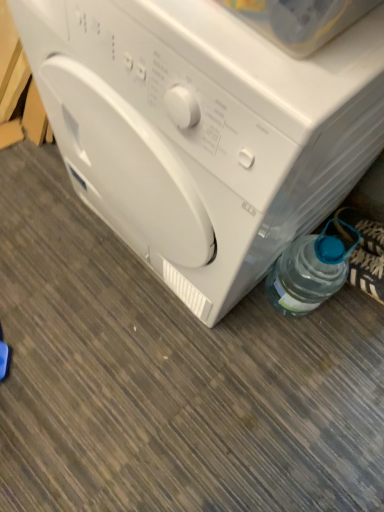
Question: Is clear plastic bottle at lower right at the back of white plastic washing machine at center?

Choices:
 (A) no
 (B) yes

Answer: (A)

Question: Can you confirm if white plastic washing machine at center is positioned to the left of clear plastic bottle at lower right?

Choices:
 (A) yes
 (B) no

Answer: (A)

Question: Considering the relative sizes of white plastic washing machine at center and clear plastic bottle at lower right in the image provided, is white plastic washing machine at center wider than clear plastic bottle at lower right?

Choices:
 (A) yes
 (B) no

Answer: (A)

Question: Is white plastic washing machine at center taller than clear plastic bottle at lower right?

Choices:
 (A) yes
 (B) no

Answer: (B)

Question: Is white plastic washing machine at center bigger than clear plastic bottle at lower right?

Choices:
 (A) yes
 (B) no

Answer: (A)

Question: Is clear plastic bottle at lower right taller or shorter than white plastic washing machine at center?

Choices:
 (A) tall
 (B) short

Answer: (A)

Question: Considering the positions of clear plastic bottle at lower right and white plastic washing machine at center in the image, is clear plastic bottle at lower right wider or thinner than white plastic washing machine at center?

Choices:
 (A) wide
 (B) thin

Answer: (B)

Question: From the image's perspective, is clear plastic bottle at lower right above or below white plastic washing machine at center?

Choices:
 (A) below
 (B) above

Answer: (B)

Question: Relative to white plastic washing machine at center, is clear plastic bottle at lower right in front or behind?

Choices:
 (A) front
 (B) behind

Answer: (B)

Question: In the image, is white glossy washing machine at center positioned in front of or behind clear plastic bottle at lower right?

Choices:
 (A) front
 (B) behind

Answer: (A)

Question: Would you say white glossy washing machine at center is inside or outside clear plastic bottle at lower right?

Choices:
 (A) inside
 (B) outside

Answer: (B)

Question: Considering the positions of white glossy washing machine at center and clear plastic bottle at lower right in the image, is white glossy washing machine at center taller or shorter than clear plastic bottle at lower right?

Choices:
 (A) tall
 (B) short

Answer: (A)

Question: From the image's perspective, is white glossy washing machine at center located above or below clear plastic bottle at lower right?

Choices:
 (A) above
 (B) below

Answer: (A)

Question: In terms of width, does white plastic washing machine at center look wider or thinner when compared to clear plastic bottle at lower right?

Choices:
 (A) wide
 (B) thin

Answer: (A)

Question: From a real-world perspective, is white plastic washing machine at center physically located above or below clear plastic bottle at lower right?

Choices:
 (A) below
 (B) above

Answer: (A)